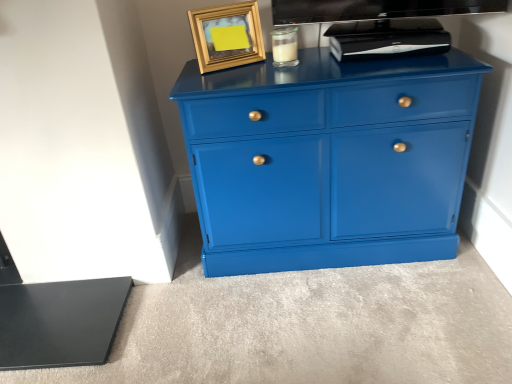
Question: Does clear glass jar at upper center contain black plastic device at upper center?

Choices:
 (A) no
 (B) yes

Answer: (A)

Question: Is clear glass jar at upper center with black plastic device at upper center?

Choices:
 (A) yes
 (B) no

Answer: (B)

Question: From a real-world perspective, is clear glass jar at upper center located higher than black plastic device at upper center?

Choices:
 (A) yes
 (B) no

Answer: (A)

Question: Considering the relative positions of clear glass jar at upper center and black plastic device at upper center in the image provided, is clear glass jar at upper center to the right of black plastic device at upper center from the viewer's perspective?

Choices:
 (A) yes
 (B) no

Answer: (B)

Question: From the image's perspective, does clear glass jar at upper center appear higher than black plastic device at upper center?

Choices:
 (A) no
 (B) yes

Answer: (A)

Question: Does clear glass jar at upper center appear on the left side of black plastic device at upper center?

Choices:
 (A) no
 (B) yes

Answer: (B)

Question: Is glossy blue cabinet at center smaller than clear glass jar at upper center?

Choices:
 (A) yes
 (B) no

Answer: (B)

Question: Is glossy blue cabinet at center oriented away from clear glass jar at upper center?

Choices:
 (A) yes
 (B) no

Answer: (B)

Question: Are glossy blue cabinet at center and clear glass jar at upper center far apart?

Choices:
 (A) no
 (B) yes

Answer: (A)

Question: Does glossy blue cabinet at center appear on the right side of clear glass jar at upper center?

Choices:
 (A) no
 (B) yes

Answer: (B)

Question: Is glossy blue cabinet at center behind clear glass jar at upper center?

Choices:
 (A) no
 (B) yes

Answer: (A)

Question: Is glossy blue cabinet at center wider than clear glass jar at upper center?

Choices:
 (A) no
 (B) yes

Answer: (B)

Question: Can you confirm if gold metallic picture frame at upper center is taller than glossy blue cabinet at center?

Choices:
 (A) yes
 (B) no

Answer: (B)